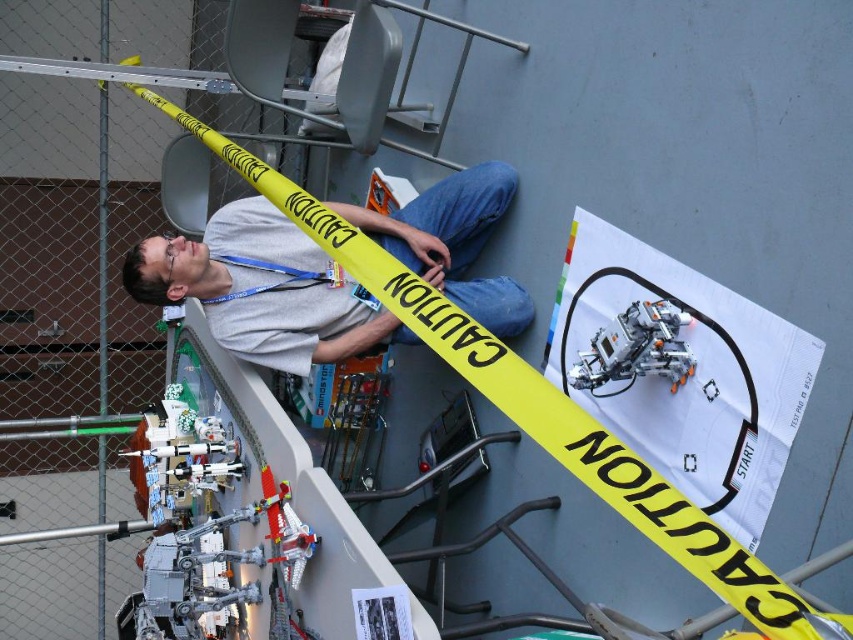
Where is the gray fabric shirt at center located in the image?

The gray fabric shirt at center is located at point (263,289) in the image.